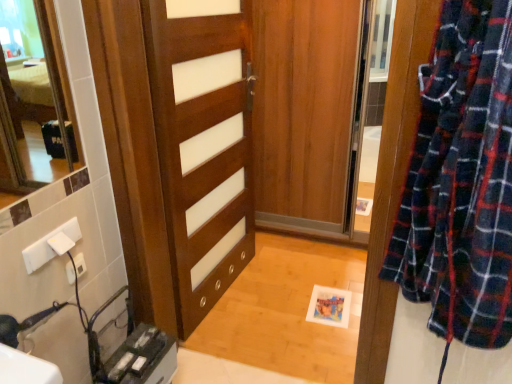
Question: Is wooden door at center completely or partially outside of white plastic electric outlet at lower left?

Choices:
 (A) yes
 (B) no

Answer: (A)

Question: From the image's perspective, would you say wooden door at center is shown under white plastic electric outlet at lower left?

Choices:
 (A) no
 (B) yes

Answer: (A)

Question: From a real-world perspective, is wooden door at center on top of white plastic electric outlet at lower left?

Choices:
 (A) no
 (B) yes

Answer: (B)

Question: Is the position of wooden door at center less distant than that of white plastic electric outlet at lower left?

Choices:
 (A) no
 (B) yes

Answer: (B)

Question: Is wooden door at center wider than white plastic electric outlet at lower left?

Choices:
 (A) yes
 (B) no

Answer: (A)

Question: From a real-world perspective, is wooden door at center located beneath white plastic electric outlet at lower left?

Choices:
 (A) yes
 (B) no

Answer: (B)

Question: From the image's perspective, is white plastic electric outlet at lower left located above wooden door at center?

Choices:
 (A) no
 (B) yes

Answer: (A)

Question: Is wooden door at center completely or partially inside white plastic electric outlet at lower left?

Choices:
 (A) yes
 (B) no

Answer: (B)

Question: Considering the relative sizes of white plastic electric outlet at lower left and wooden door at center in the image provided, is white plastic electric outlet at lower left taller than wooden door at center?

Choices:
 (A) no
 (B) yes

Answer: (A)

Question: Is white plastic electric outlet at lower left facing away from wooden door at center?

Choices:
 (A) no
 (B) yes

Answer: (A)

Question: Does white plastic electric outlet at lower left lie in front of wooden door at center?

Choices:
 (A) no
 (B) yes

Answer: (A)

Question: Is white plastic electric outlet at lower left far away from wooden door at center?

Choices:
 (A) yes
 (B) no

Answer: (B)

Question: Is wooden door at center spatially inside white plastic electric outlet at lower left, or outside of it?

Choices:
 (A) outside
 (B) inside

Answer: (A)